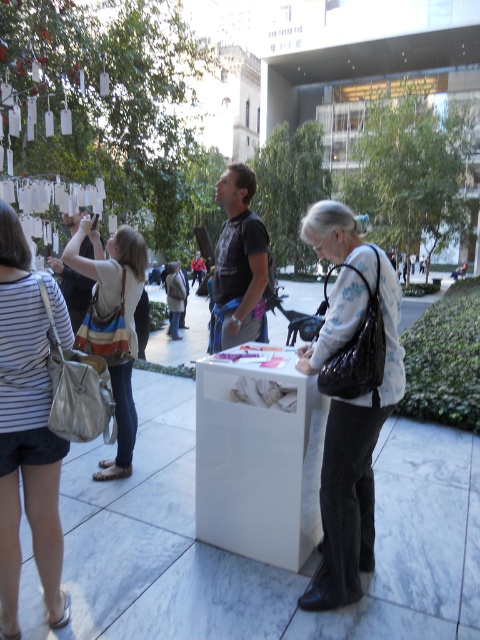
Question: Considering the real-world distances, which object is farthest from the striped fabric purse at left?

Choices:
 (A) striped fabric shirt at left
 (B) matte black purse at center

Answer: (B)

Question: Is striped fabric shirt at left below striped fabric purse at left?

Choices:
 (A) yes
 (B) no

Answer: (A)

Question: Which point is farther from the camera taking this photo?

Choices:
 (A) (127, 314)
 (B) (372, 496)
 (C) (37, 515)

Answer: (A)

Question: Does matte black purse at center have a greater width compared to striped fabric purse at left?

Choices:
 (A) yes
 (B) no

Answer: (B)

Question: Does striped fabric shirt at left have a lesser width compared to striped fabric purse at left?

Choices:
 (A) yes
 (B) no

Answer: (A)

Question: Which point appears closest to the camera in this image?

Choices:
 (A) (360, 467)
 (B) (117, 264)
 (C) (15, 256)

Answer: (C)